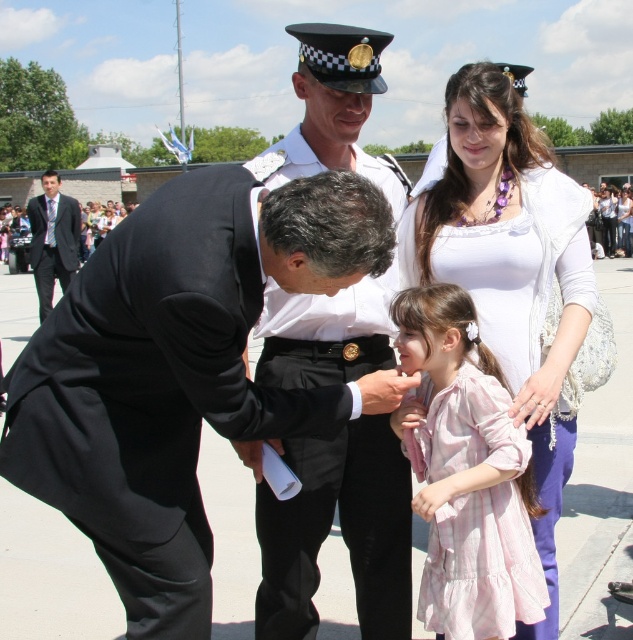
Question: From the image, what is the correct spatial relationship of pink cotton dress at center in relation to white cotton dress at center?

Choices:
 (A) below
 (B) above

Answer: (A)

Question: Does pink cotton dress at center have a greater width compared to white cotton dress at center?

Choices:
 (A) no
 (B) yes

Answer: (A)

Question: Which is nearer to the black suit at left?

Choices:
 (A) black matte suit at center
 (B) white cotton dress at center
 (C) white uniform at center

Answer: (A)

Question: Considering the real-world distances, which object is closest to the white textured sweater at upper right?

Choices:
 (A) pink cotton dress at center
 (B) white uniform at center
 (C) white cotton dress at center
 (D) black matte suit at center

Answer: (A)

Question: Can you confirm if black matte suit at center is thinner than white textured sweater at upper right?

Choices:
 (A) yes
 (B) no

Answer: (B)

Question: Which of the following is the closest to the observer?

Choices:
 (A) (487, 115)
 (B) (44, 234)
 (C) (606, 224)
 (D) (448, 518)

Answer: (D)